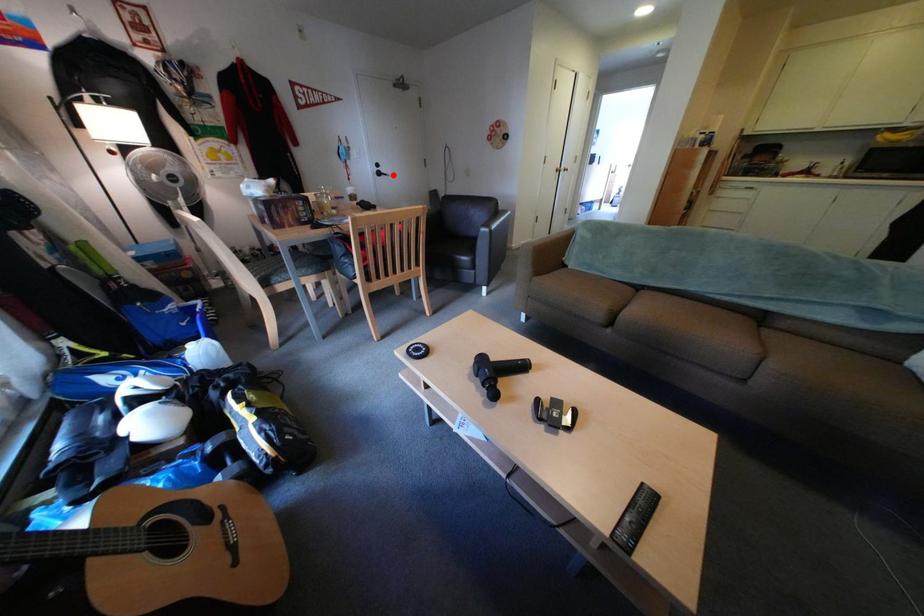
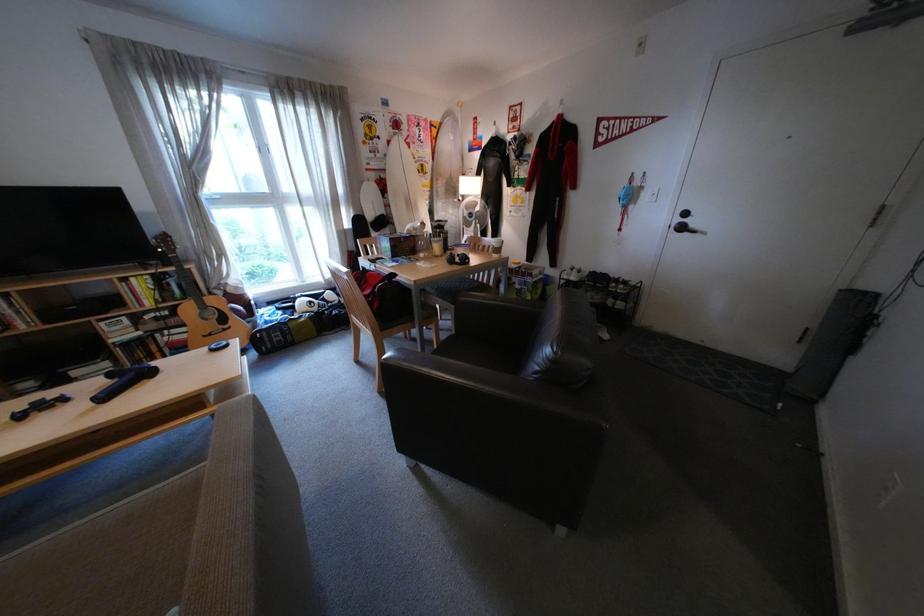
Question: I am providing you with two images of the same scene from different viewpoints. A red point is shown in image1. For the corresponding object point in image2, is it positioned nearer or farther from the camera?

Choices:
 (A) Nearer
 (B) Farther

Answer: (B)